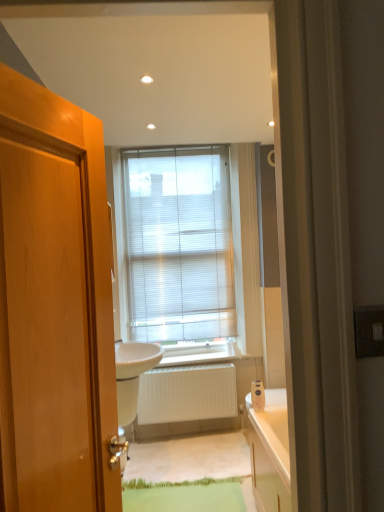
Question: Looking at the image, does white glossy sink at center seem bigger or smaller compared to silver metallic door handle at lower left?

Choices:
 (A) big
 (B) small

Answer: (A)

Question: Is white glossy sink at center wider or thinner than silver metallic door handle at lower left?

Choices:
 (A) thin
 (B) wide

Answer: (B)

Question: Which of these objects is positioned farthest from the white matte radiator at center?

Choices:
 (A) silver metallic door handle at lower left
 (B) white/translucent blinds at center
 (C) white glossy sink at center

Answer: (B)

Question: Estimate the real-world distances between objects in this image. Which object is closer to the silver metallic door handle at lower left?

Choices:
 (A) white matte radiator at center
 (B) white/translucent blinds at center
 (C) white glossy sink at center

Answer: (C)